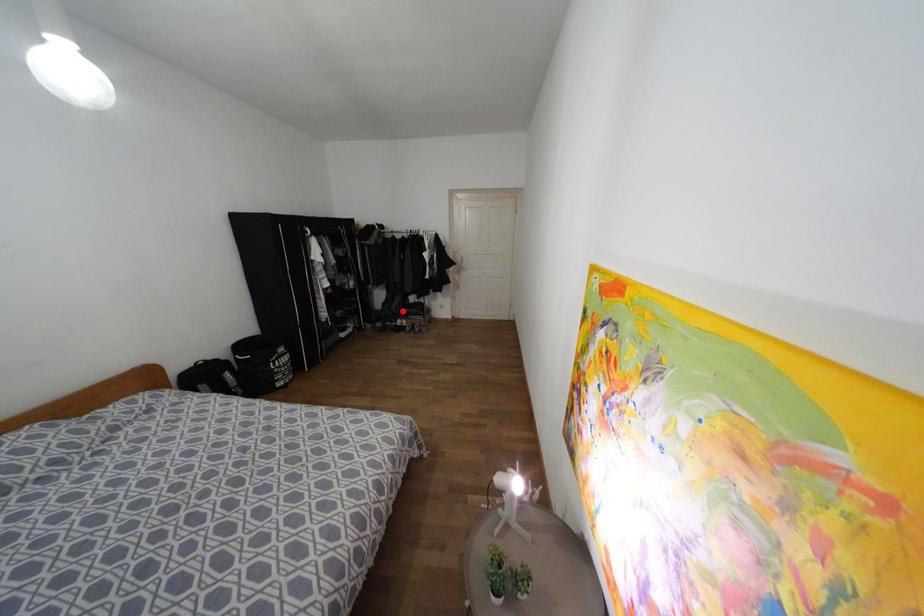
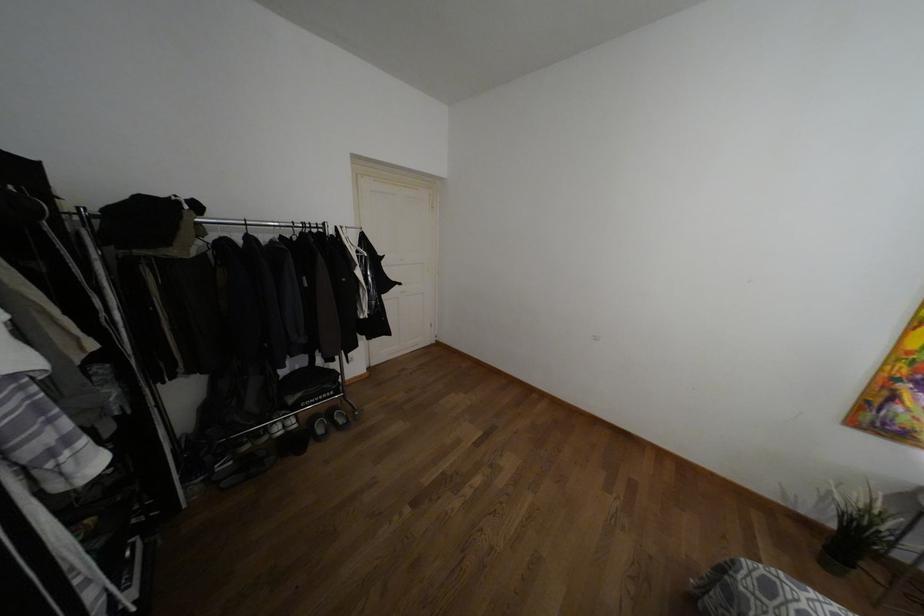
Question: I am providing you with two images of the same scene from different viewpoints. In image1, a red point is highlighted. Considering the same 3D point in image2, which of the following is correct?

Choices:
 (A) It is closer
 (B) It is farther

Answer: (A)